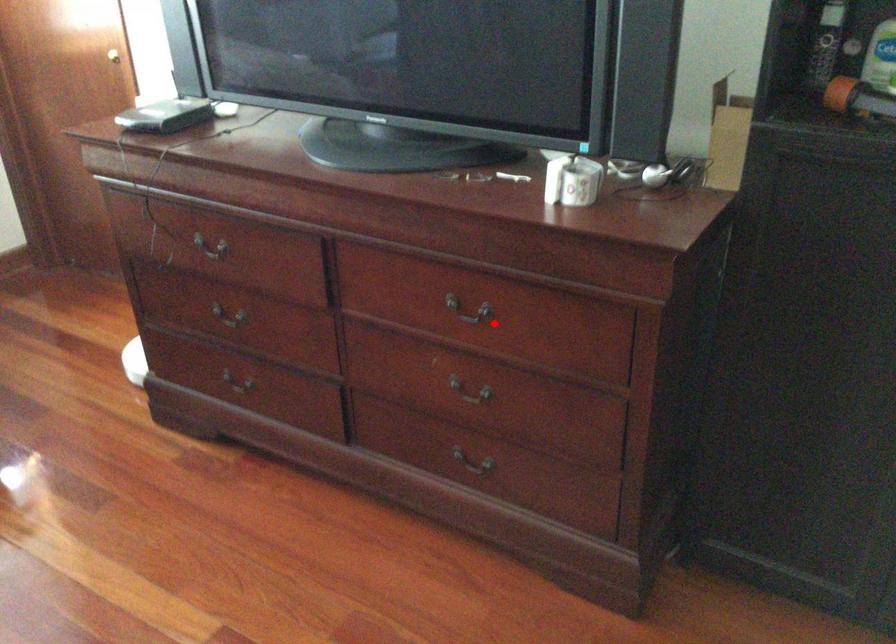
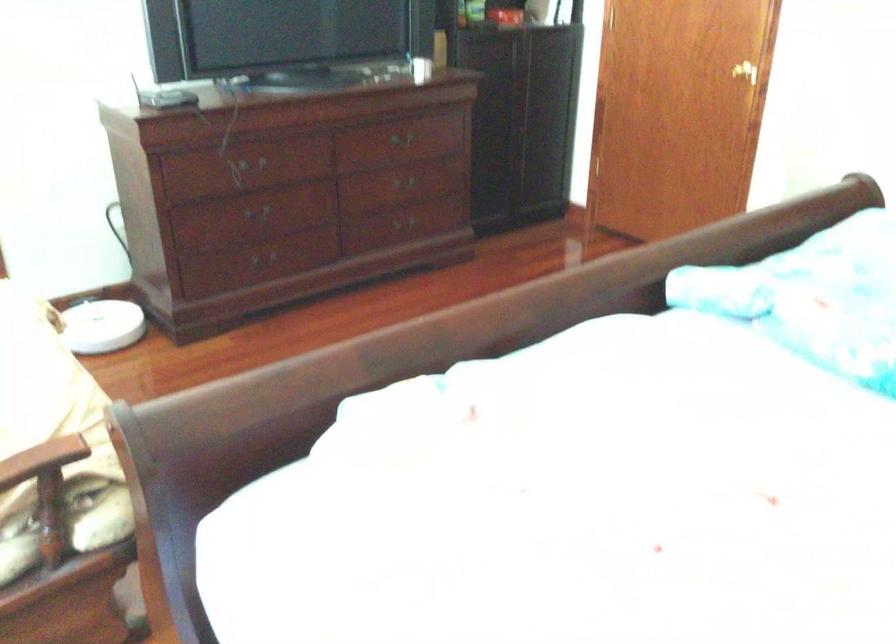
Where in the second image is the point corresponding to the highlighted location from the first image?

(401, 138)